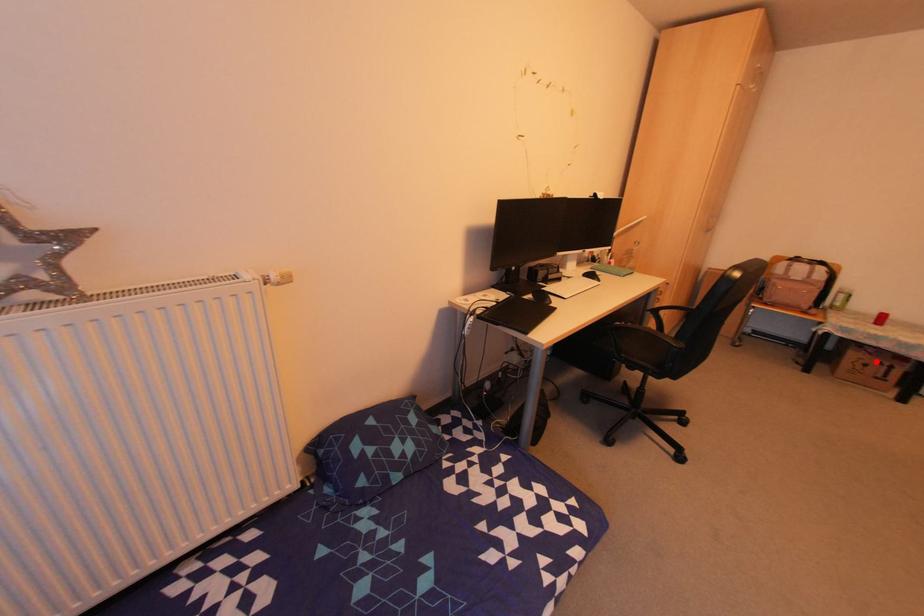
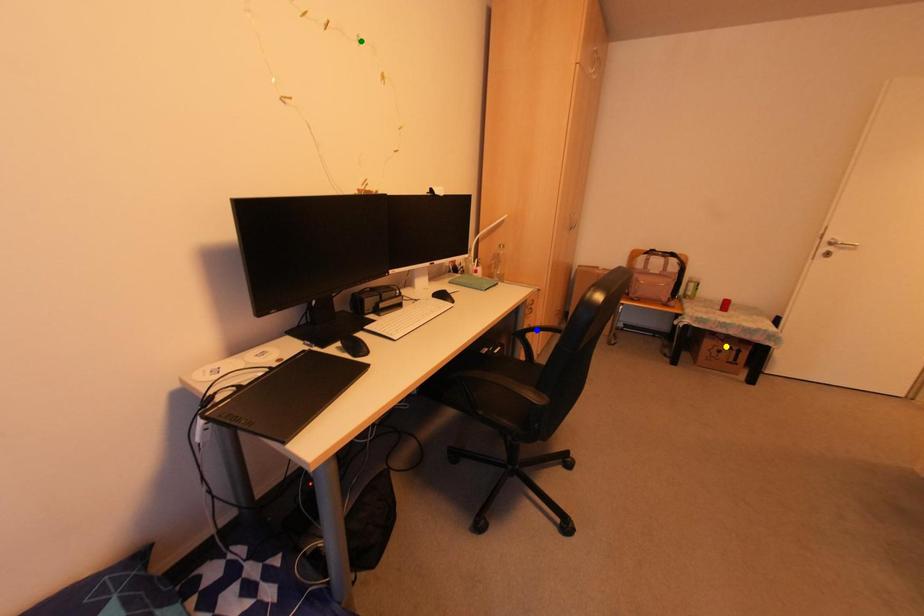
Question: I am providing you with two images of the same scene from different viewpoints. A red point is marked on the first image. You are given multiple points on the second image. Which mark in image 2 goes with the point in image 1?

Choices:
 (A) yellow point
 (B) blue point
 (C) green point

Answer: (A)